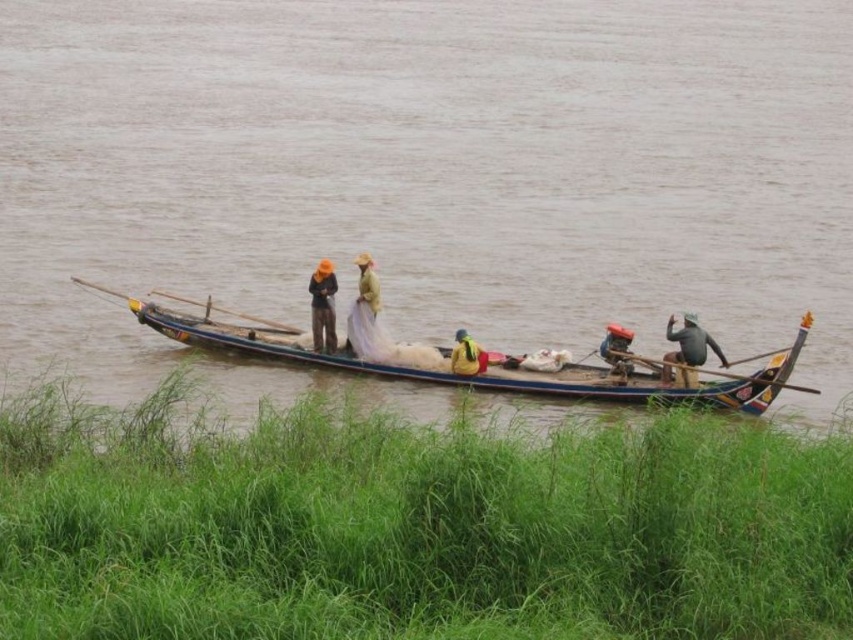
Question: Is light brown woven hat at center smaller than yellow fabric at center?

Choices:
 (A) no
 (B) yes

Answer: (A)

Question: Which object appears farthest from the camera in this image?

Choices:
 (A) wooden boat at center
 (B) dark gray fabric at right

Answer: (B)

Question: Is dark gray fabric at right above yellow fabric at center?

Choices:
 (A) yes
 (B) no

Answer: (A)

Question: Does light brown woven hat at center appear on the right side of matte black jacket at center?

Choices:
 (A) yes
 (B) no

Answer: (A)

Question: Which object appears farthest from the camera in this image?

Choices:
 (A) yellow fabric at center
 (B) matte black jacket at center

Answer: (B)

Question: Which point appears closest to the camera in this image?

Choices:
 (A) (315, 346)
 (B) (480, 352)
 (C) (660, 376)

Answer: (B)